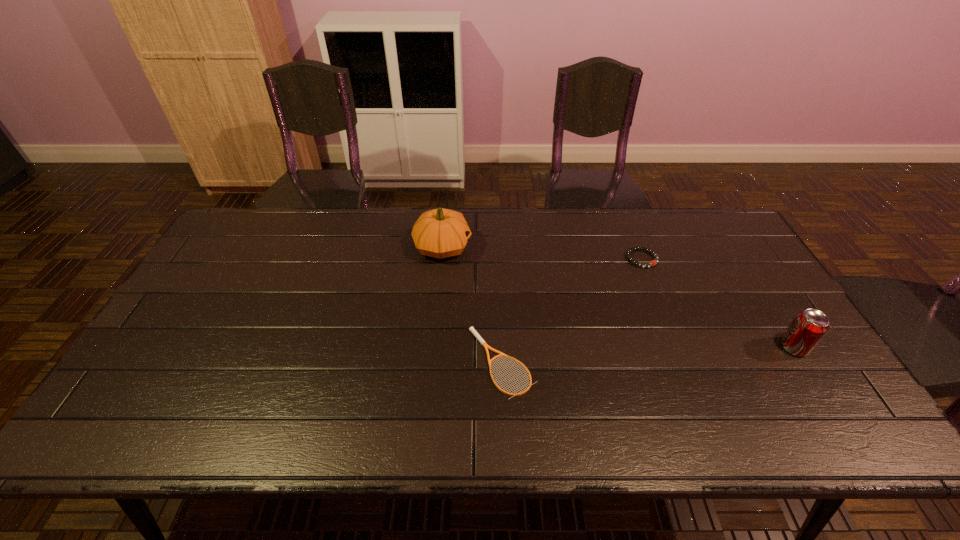
Locate an element on the screen. the tallest object is located at coordinates (439, 233).

Identify the location of soda can. (807, 329).

You are a GUI agent. You are given a task and a screenshot of the screen. Output one action in this format:
    pyautogui.click(x=<x>, y=<y>)
    Task: Click on the rightmost object
    This screenshot has width=960, height=540.
    Given the screenshot: What is the action you would take?
    pyautogui.click(x=807, y=329)

The width and height of the screenshot is (960, 540). Identify the location of the third tallest object. (628, 254).

I want to click on the third object from left to right, so click(x=628, y=254).

In order to click on the shortest object in this screenshot , I will do `click(480, 339)`.

You are a GUI agent. You are given a task and a screenshot of the screen. Output one action in this format:
    pyautogui.click(x=<x>, y=<y>)
    Task: Click on the vacant area located 0.340m on the side of the tallest object with the carved face
    
    Given the screenshot: What is the action you would take?
    pyautogui.click(x=576, y=247)

Where is `vacant space situated 0.130m on the back of the third shortest object`? The height and width of the screenshot is (540, 960). vacant space situated 0.130m on the back of the third shortest object is located at coordinates [x=764, y=301].

Locate an element on the screen. The height and width of the screenshot is (540, 960). free spot located 0.140m on the right of the second object from right to left is located at coordinates (702, 259).

Find the location of `vacant space located 0.290m on the right of the shortest object`. vacant space located 0.290m on the right of the shortest object is located at coordinates (649, 362).